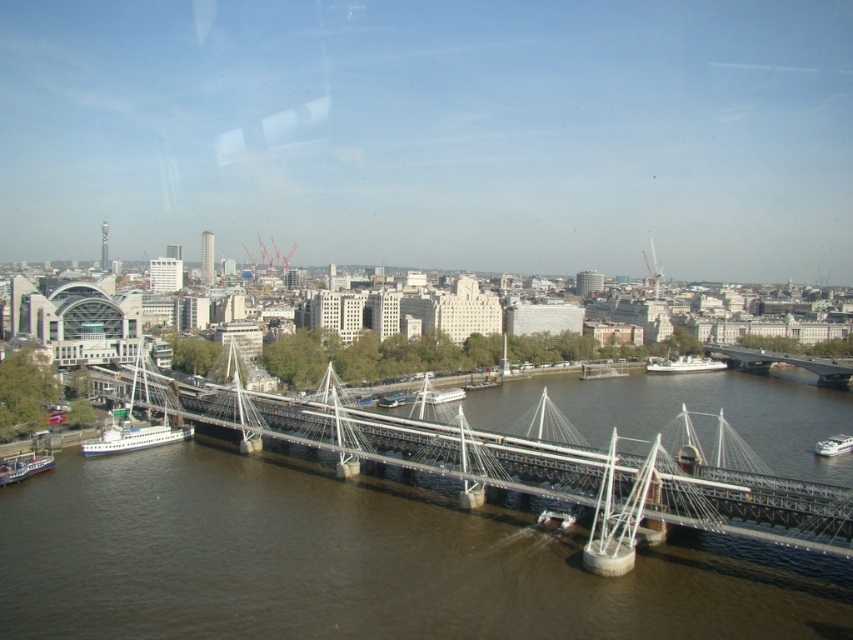
You are a photographer planning to capture a wide shot of the suspension bridge and its surroundings. You notice two boats near the base of the bridge on the left side. Which boat, the green metallic boat at lower left or the white glossy ferry at lower left, is wider and would require more space in your composition?

The green metallic boat at lower left is wider than the white glossy ferry at lower left, so it would require more space in your composition.